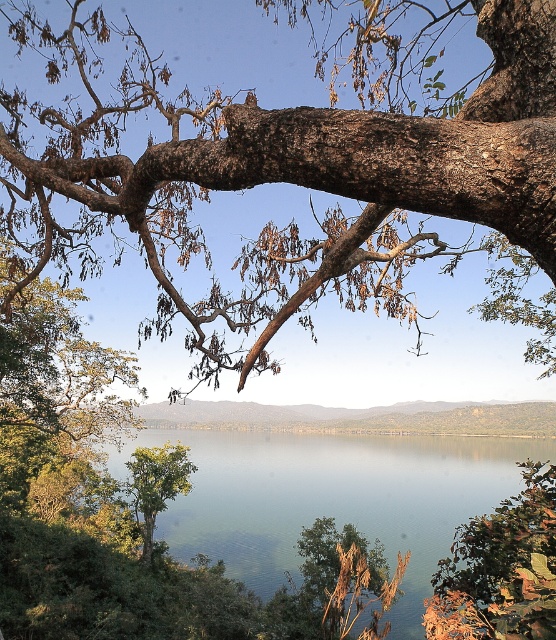
In the scene shown: You are standing at the edge of the water and want to pick up the green matte leaves at lower right and the green leafy tree at center. Which object is closer to you?

The green matte leaves at lower right is positioned over the green leafy tree at center, meaning it is closer to you.

You are standing at the base of the large tree branch in the image and want to place a small marker at each of the two points labeled point (420, 561) and point (146, 552). Which point will your marker be closer to you when placed?

Point (420, 561) is closer to the viewer than point (146, 552), so the marker placed at point (420, 561) will be closer to you.

In the scene shown: You are an artist sketching this scene. You want to emphasize the contrast between the brown rough tree branch at upper center and the green matte leaves at lower right. Which object should you draw first to establish the main structure of the composition?

The brown rough tree branch at upper center should be drawn first because it has a larger size compared to the green matte leaves at lower right, making it the dominant element in the composition.